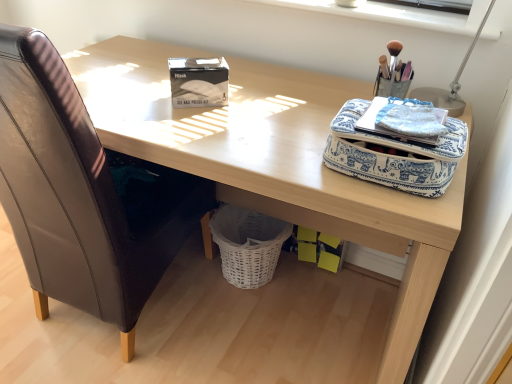
Identify the location of vacant space underneath wooden desk at center (from a real-world perspective). This screenshot has width=512, height=384. (273, 314).